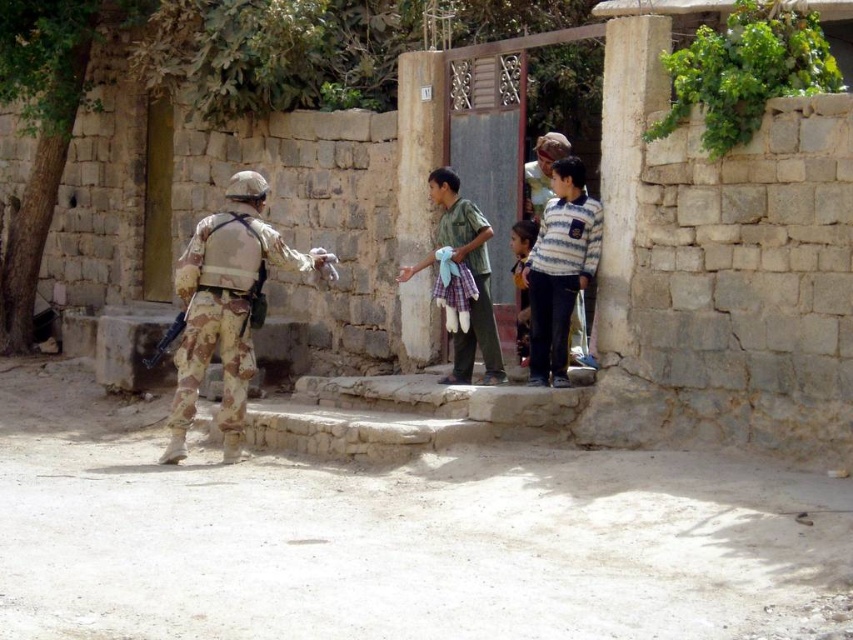
Based on the scene description, which object is taller between the green plaid shorts at center and the light brown fabric shirt at center?

The green plaid shorts at center is much taller than the light brown fabric shirt at center according to the description.

You are a tailor observing the clothing items worn by the children in the scene. Which clothing item, the green plaid shorts at center or the light brown fabric shirt at center, has a bigger size?

The green plaid shorts at center has a larger size compared to the light brown fabric shirt at center.

Based on the scene description, where is the camouflage uniform at left located in terms of its 2D coordinates?

The camouflage uniform at left is located at the 2D coordinates of point (225, 307).